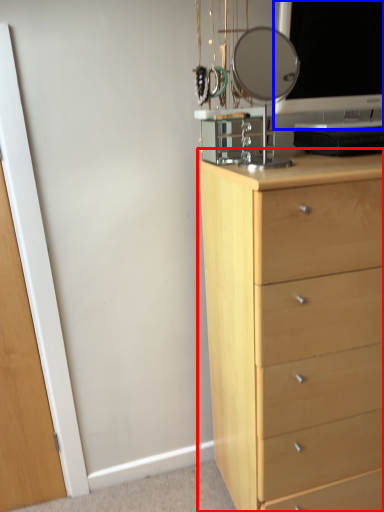
Question: Which of the following is the closest to the observer, chest of drawers (highlighted by a red box) or computer monitor (highlighted by a blue box)?

Choices:
 (A) chest of drawers
 (B) computer monitor

Answer: (A)